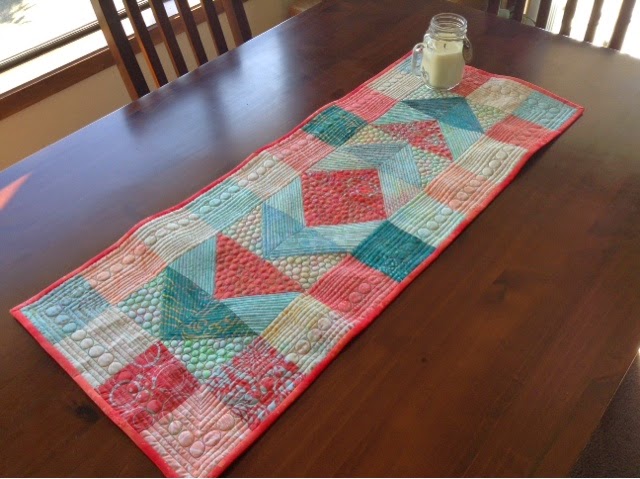
This screenshot has width=640, height=479. I want to click on chair, so click(132, 22).